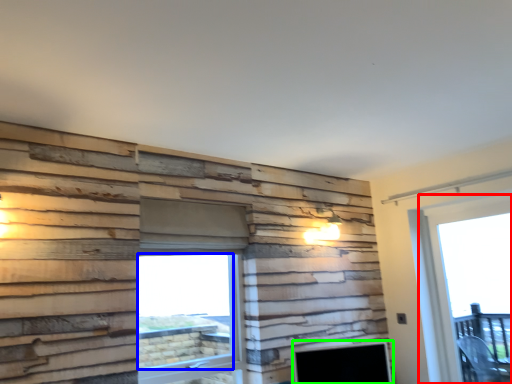
Question: Which object is the closest to the window (highlighted by a red box)? Choose among these: window screen (highlighted by a blue box) or fireplace (highlighted by a green box).

Choices:
 (A) window screen
 (B) fireplace

Answer: (B)